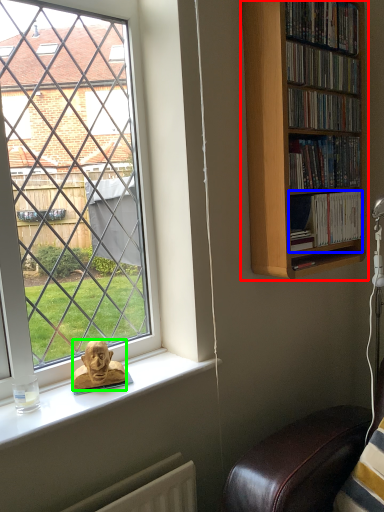
Question: Based on their relative distances, which object is farther from bookcase (highlighted by a red box)? Choose from book (highlighted by a blue box) and person (highlighted by a green box).

Choices:
 (A) book
 (B) person

Answer: (B)